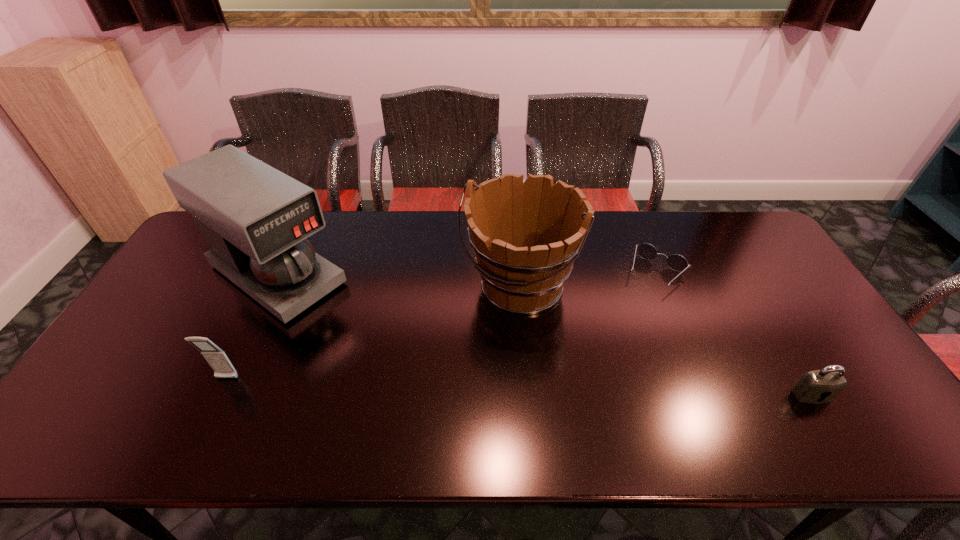
Locate an element on the screen. The height and width of the screenshot is (540, 960). free space at the near left corner of the desktop is located at coordinates (97, 395).

In the image, there is a desktop. At what (x,y) coordinates should I click in order to perform the action: click on vacant space at the far right corner. Please return your answer as a coordinate pair (x, y). This screenshot has height=540, width=960. Looking at the image, I should click on (721, 252).

Image resolution: width=960 pixels, height=540 pixels. What are the coordinates of `vacant area that lies between the padlock and the coffee maker` in the screenshot? It's located at (544, 335).

Locate an element on the screen. vacant point located between the second nearest object and the spectacles is located at coordinates (442, 326).

Where is `vacant space that's between the second object from right to left and the padlock`? vacant space that's between the second object from right to left and the padlock is located at coordinates (733, 334).

Where is `free spot between the third tallest object and the nearest object`? free spot between the third tallest object and the nearest object is located at coordinates (519, 387).

What are the coordinates of `unoccupied area between the second shortest object and the coffee maker` in the screenshot? It's located at (544, 335).

Locate an element on the screen. This screenshot has width=960, height=540. free point between the fourth farthest object and the shortest object is located at coordinates (442, 326).

I want to click on vacant point located between the spectacles and the wine bucket, so click(588, 280).

This screenshot has height=540, width=960. In order to click on free spot between the padlock and the shortest object in this screenshot , I will do `click(733, 334)`.